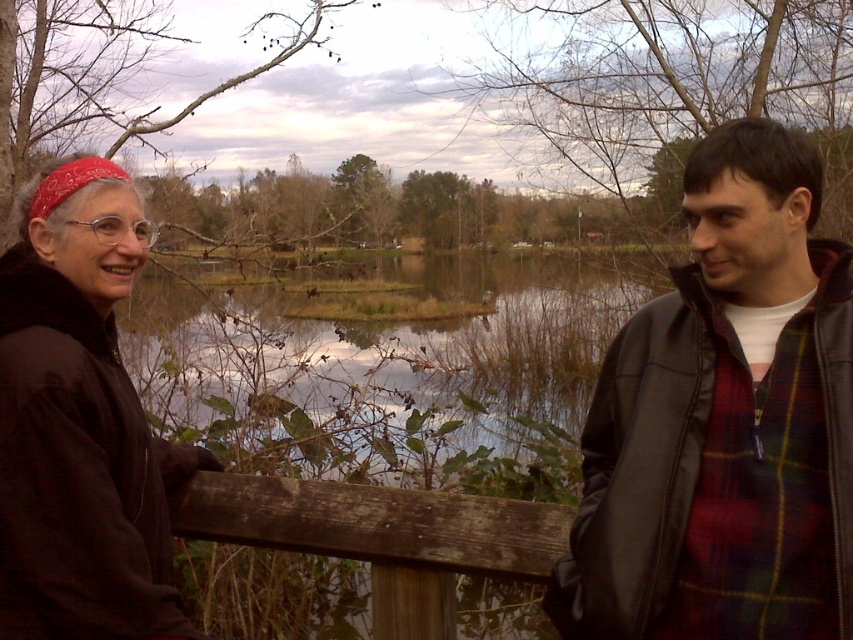
Question: Can you confirm if leather jacket at right is bigger than weathered wood fence at center?

Choices:
 (A) yes
 (B) no

Answer: (A)

Question: Which of the following is the closest to the observer?

Choices:
 (A) (74, 388)
 (B) (706, 154)

Answer: (B)

Question: Among these objects, which one is farthest from the camera?

Choices:
 (A) matte black jacket at left
 (B) leather jacket at right
 (C) weathered wood fence at center

Answer: (C)

Question: Does matte black jacket at left appear on the right side of weathered wood fence at center?

Choices:
 (A) no
 (B) yes

Answer: (A)

Question: Which of the following is the closest to the observer?

Choices:
 (A) (123, 572)
 (B) (259, 506)
 (C) (613, 378)

Answer: (A)

Question: Does leather jacket at right appear under matte black jacket at left?

Choices:
 (A) no
 (B) yes

Answer: (A)